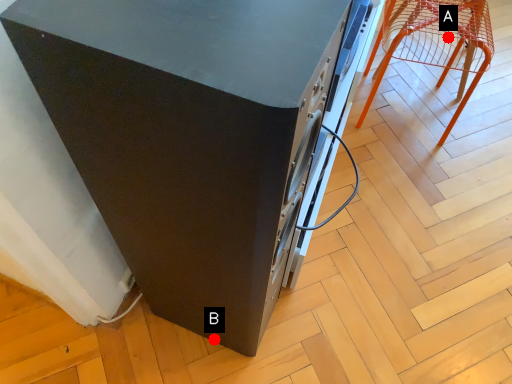
Question: Two points are circled on the image, labeled by A and B beside each circle. Among these points, which one is nearest to the camera?

Choices:
 (A) A is closer
 (B) B is closer

Answer: (B)